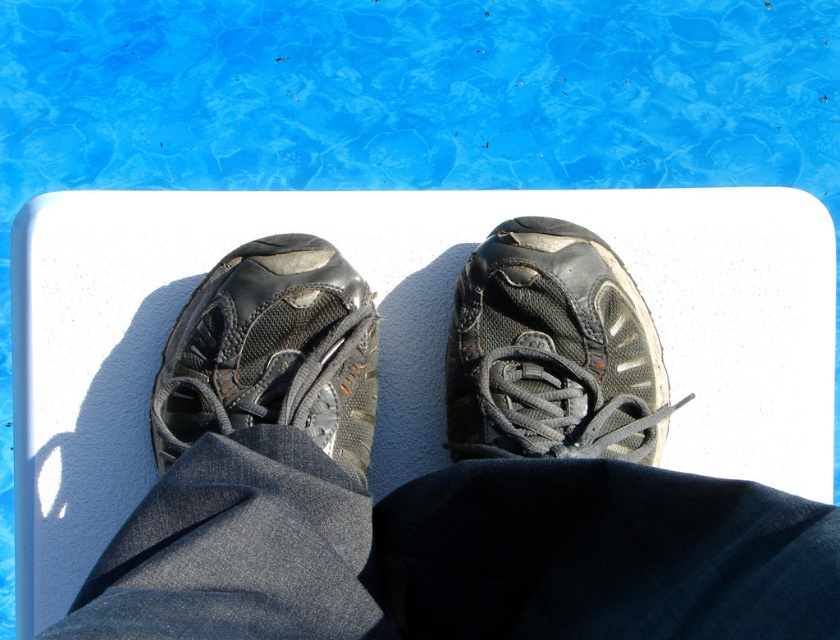
Question: Among these points, which one is nearest to the camera?

Choices:
 (A) (x=639, y=456)
 (B) (x=201, y=304)

Answer: (A)

Question: Can you confirm if black mesh shoe at center is positioned to the left of leather/black shoe at center?

Choices:
 (A) no
 (B) yes

Answer: (A)

Question: Does black mesh shoe at center have a larger size compared to leather/black shoe at center?

Choices:
 (A) yes
 (B) no

Answer: (A)

Question: Can you confirm if black mesh shoe at center is positioned to the right of leather/black shoe at center?

Choices:
 (A) yes
 (B) no

Answer: (A)

Question: Which point appears closest to the camera in this image?

Choices:
 (A) (224, 388)
 (B) (596, 256)

Answer: (A)